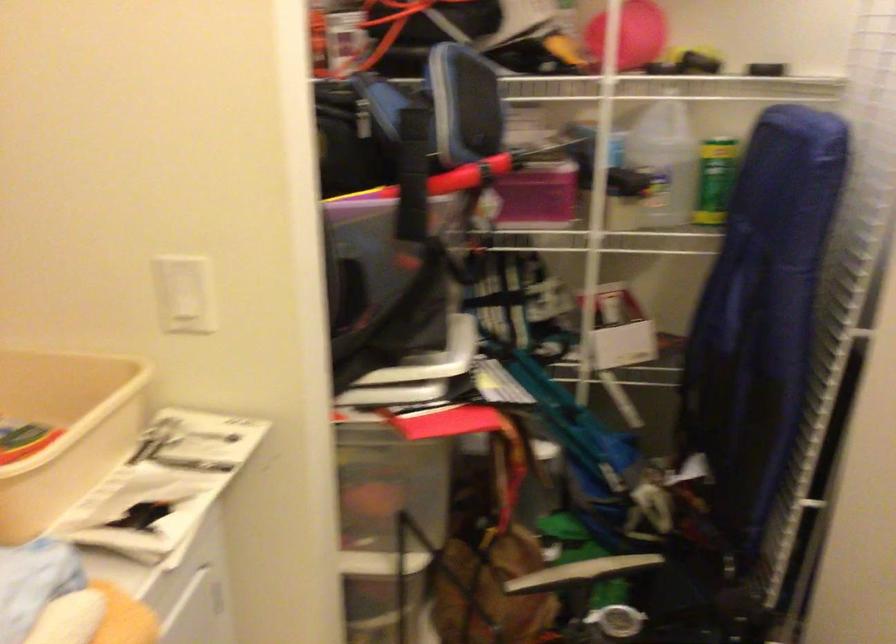
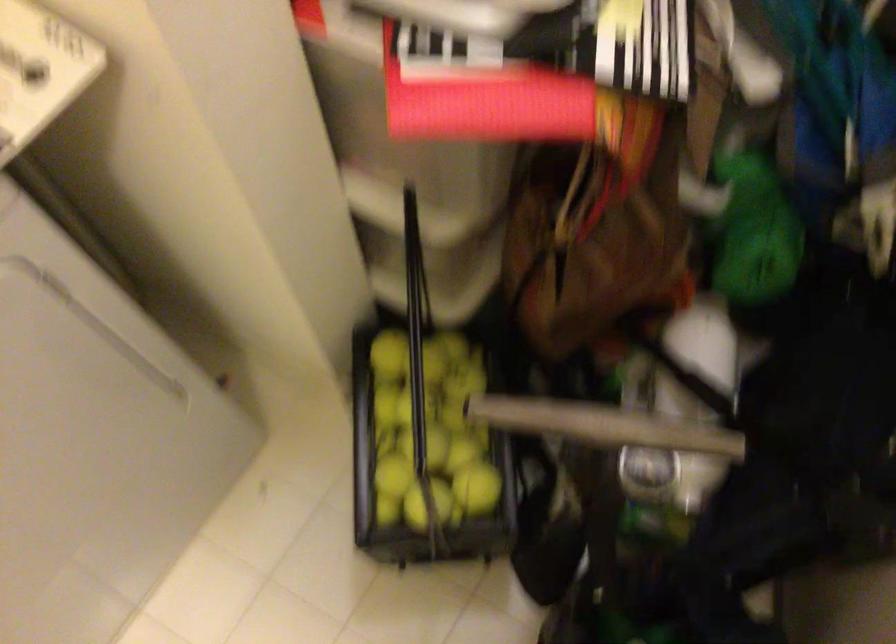
Question: The first image is from the beginning of the video and the second image is from the end. How did the camera likely rotate when shooting the video?

Choices:
 (A) Left
 (B) Right
 (C) Up
 (D) Down

Answer: (D)